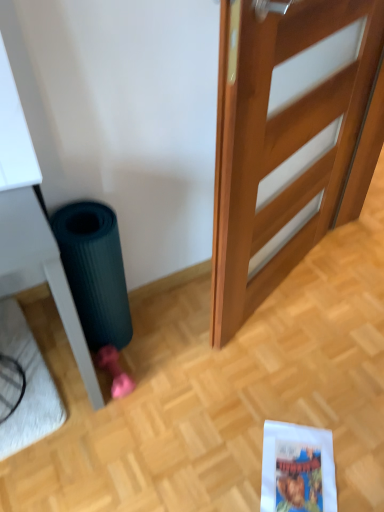
In order to click on wooden door at center in this screenshot , I will do pos(288,144).

Describe the element at coordinates (288, 144) in the screenshot. The height and width of the screenshot is (512, 384). I see `wooden door at center` at that location.

Where is `white plush doormat at lower left`? This screenshot has height=512, width=384. white plush doormat at lower left is located at coordinates (27, 385).

What do you see at coordinates (27, 385) in the screenshot? The width and height of the screenshot is (384, 512). I see `white plush doormat at lower left` at bounding box center [27, 385].

Identify the location of dark green rubber mat at lower left. The image size is (384, 512). (95, 271).

The image size is (384, 512). In order to click on wooden door at center in this screenshot , I will do `click(288, 144)`.

Would you consider wooden door at center to be distant from white plush doormat at lower left?

Yes, wooden door at center is far from white plush doormat at lower left.

Which of these two, wooden door at center or white plush doormat at lower left, stands taller?

wooden door at center.

Which is more to the left, wooden door at center or white plush doormat at lower left?

Positioned to the left is white plush doormat at lower left.

Considering the relative sizes of wooden door at center and white plush doormat at lower left in the image provided, is wooden door at center wider than white plush doormat at lower left?

No, wooden door at center is not wider than white plush doormat at lower left.

Can you confirm if white plush doormat at lower left is bigger than blue glossy comic book at lower right?

Yes.

From a real-world perspective, which is physically above, white plush doormat at lower left or blue glossy comic book at lower right?

From a 3D spatial view, white plush doormat at lower left is above.

How distant is white plush doormat at lower left from blue glossy comic book at lower right?

white plush doormat at lower left and blue glossy comic book at lower right are 30.86 inches apart from each other.

Considering the positions of objects white plush doormat at lower left and blue glossy comic book at lower right in the image provided, who is in front, white plush doormat at lower left or blue glossy comic book at lower right?

blue glossy comic book at lower right is in front.

Is dark green rubber mat at lower left facing away from blue glossy comic book at lower right?

That's not correct — dark green rubber mat at lower left is not looking away from blue glossy comic book at lower right.

Where is `comic book that is below the dark green rubber mat at lower left (from the image's perspective)`? This screenshot has width=384, height=512. comic book that is below the dark green rubber mat at lower left (from the image's perspective) is located at coordinates (297, 468).

Based on the photo, how different are the orientations of dark green rubber mat at lower left and blue glossy comic book at lower right in degrees?

dark green rubber mat at lower left and blue glossy comic book at lower right are facing 141 degrees away from each other.

Between dark green rubber mat at lower left and blue glossy comic book at lower right, which one has smaller size?

With smaller size is blue glossy comic book at lower right.

Which of these two, white plush doormat at lower left or wooden door at center, stands shorter?

With less height is white plush doormat at lower left.

Is white plush doormat at lower left at the right side of wooden door at center?

No.

Which object is thinner, white plush doormat at lower left or wooden door at center?

With smaller width is wooden door at center.

Is blue glossy comic book at lower right to the right of wooden door at center from the viewer's perspective?

No.

From the picture: From a real-world perspective, is blue glossy comic book at lower right on top of wooden door at center?

No, from a real-world perspective, blue glossy comic book at lower right is not on top of wooden door at center.

From the image's perspective, between blue glossy comic book at lower right and wooden door at center, who is located below?

blue glossy comic book at lower right appears lower in the image.

In terms of size, does blue glossy comic book at lower right appear bigger or smaller than wooden door at center?

blue glossy comic book at lower right is smaller than wooden door at center.

Measure the distance from dark green rubber mat at lower left to wooden door at center.

dark green rubber mat at lower left and wooden door at center are 22.94 inches apart.

Is dark green rubber mat at lower left oriented towards wooden door at center?

No.

From a real-world perspective, which is physically below, dark green rubber mat at lower left or wooden door at center?

In real-world perspective, dark green rubber mat at lower left is lower.

From the image's perspective, who appears lower, dark green rubber mat at lower left or wooden door at center?

dark green rubber mat at lower left appears lower in the image.

Is dark green rubber mat at lower left next to white plush doormat at lower left?

dark green rubber mat at lower left and white plush doormat at lower left are clearly separated.

Which object is positioned more to the left, dark green rubber mat at lower left or white plush doormat at lower left?

white plush doormat at lower left is more to the left.

Considering the relative sizes of dark green rubber mat at lower left and white plush doormat at lower left in the image provided, is dark green rubber mat at lower left shorter than white plush doormat at lower left?

Incorrect, the height of dark green rubber mat at lower left does not fall short of that of white plush doormat at lower left.

Locate an element on the screen. door that appears above the white plush doormat at lower left (from a real-world perspective) is located at coordinates (288, 144).

Identify the location of comic book below the white plush doormat at lower left (from the image's perspective). The width and height of the screenshot is (384, 512). (297, 468).

From the image, which object appears to be farther from dark green rubber mat at lower left, white plush doormat at lower left or wooden door at center?

Among the two, wooden door at center is located further to dark green rubber mat at lower left.

When comparing their distances from dark green rubber mat at lower left, does blue glossy comic book at lower right or white plush doormat at lower left seem closer?

The object closer to dark green rubber mat at lower left is white plush doormat at lower left.

Considering their positions, is wooden door at center positioned closer to blue glossy comic book at lower right than white plush doormat at lower left?

The object closer to blue glossy comic book at lower right is wooden door at center.

Looking at the image, which one is located further to white plush doormat at lower left, dark green rubber mat at lower left or wooden door at center?

wooden door at center is further to white plush doormat at lower left.

Considering their positions, is blue glossy comic book at lower right positioned closer to white plush doormat at lower left than wooden door at center?

blue glossy comic book at lower right is positioned closer to the anchor white plush doormat at lower left.

Considering their positions, is white plush doormat at lower left positioned closer to wooden door at center than blue glossy comic book at lower right?

Based on the image, blue glossy comic book at lower right appears to be nearer to wooden door at center.

From the image, which object appears to be farther from dark green rubber mat at lower left, wooden door at center or white plush doormat at lower left?

The object further to dark green rubber mat at lower left is wooden door at center.

Which object lies further to the anchor point blue glossy comic book at lower right, wooden door at center or dark green rubber mat at lower left?

wooden door at center is positioned further to the anchor blue glossy comic book at lower right.

Find the location of a particular element. garbage between white plush doormat at lower left and wooden door at center is located at coordinates (95, 271).

Image resolution: width=384 pixels, height=512 pixels. I want to click on garbage between white plush doormat at lower left and blue glossy comic book at lower right from left to right, so 95,271.

Identify the location of comic book located between white plush doormat at lower left and wooden door at center in the left-right direction. This screenshot has height=512, width=384. (297, 468).

Locate an element on the screen. The height and width of the screenshot is (512, 384). garbage between wooden door at center and blue glossy comic book at lower right in the vertical direction is located at coordinates (95, 271).